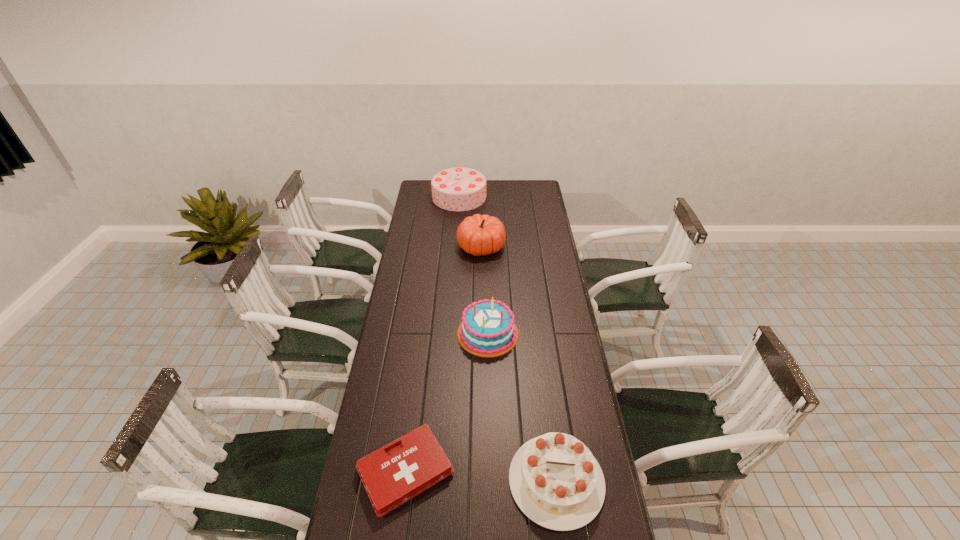
Where is `the tallest birthday cake`? The width and height of the screenshot is (960, 540). the tallest birthday cake is located at coordinates (455, 189).

This screenshot has width=960, height=540. Identify the location of the tallest object. (455, 189).

This screenshot has height=540, width=960. In order to click on the fourth nearest object in this screenshot , I will do `click(478, 235)`.

This screenshot has height=540, width=960. In order to click on the third nearest object in this screenshot , I will do `click(487, 329)`.

At what (x,y) coordinates should I click in order to perform the action: click on the second shortest birthday cake. Please return your answer as a coordinate pair (x, y). This screenshot has width=960, height=540. Looking at the image, I should click on (487, 329).

Locate an element on the screen. The image size is (960, 540). the nearest birthday cake is located at coordinates (555, 480).

Find the location of `the fourth tallest object`. the fourth tallest object is located at coordinates (555, 480).

In order to click on the shortest object in this screenshot , I will do `click(392, 475)`.

Find the location of a particular element. This screenshot has height=540, width=960. vacant region located 0.310m on the front of the tallest birthday cake is located at coordinates (456, 244).

This screenshot has height=540, width=960. Find the location of `vacant space located on the front of the fourth nearest object`. vacant space located on the front of the fourth nearest object is located at coordinates coord(481,298).